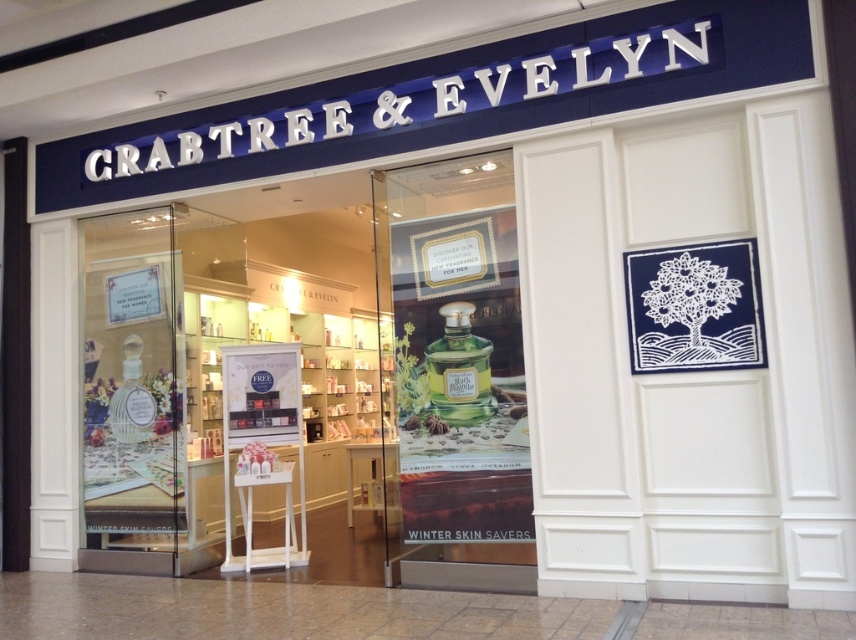
You are a delivery person who needs to place a large box in the store. The box requires a space of 30 feet to maneuver. Based on the scene, can you safely move the box through the area near the green glass perfume bottle at center?

The distance between the green glass perfume bottle at center and the camera is 26.24 feet. Since the required space is 30 feet, the box cannot be maneuvered safely in that area.

You are a customer standing outside the Crabtree and Evelyn store and see both the green glass perfume bottle at center and the green glass bottle at center through the glass doors. Which one is positioned to the left when viewed from the outside?

The green glass perfume bottle at center is positioned to the left of the green glass bottle at center when viewed from the outside.

You are a customer standing outside the Crabtree and Evelyn store. You see the green glass perfume bottle at center and the green glass bottle at center through the glass doors. Which one is closer to you?

The green glass perfume bottle at center is closer to you because the green glass bottle at center is behind it.